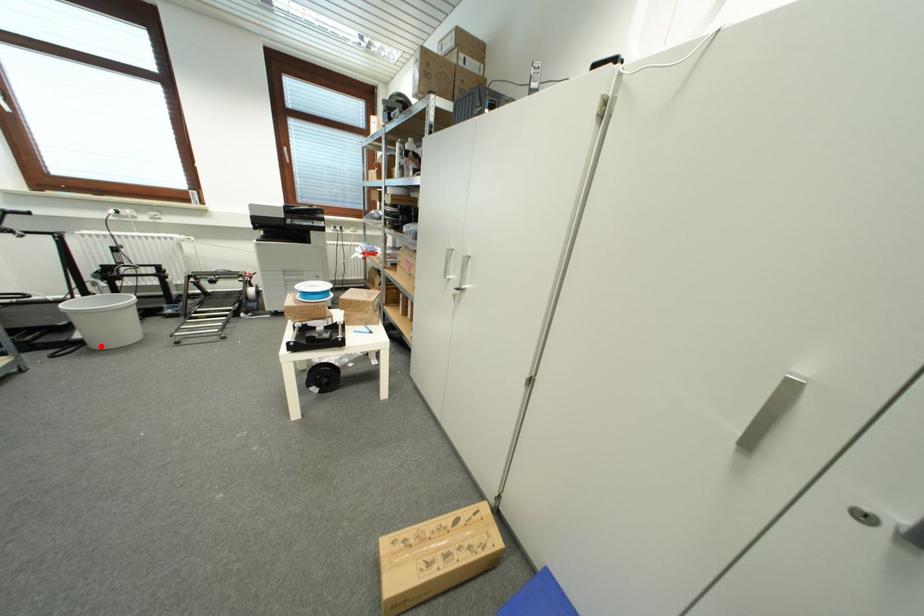
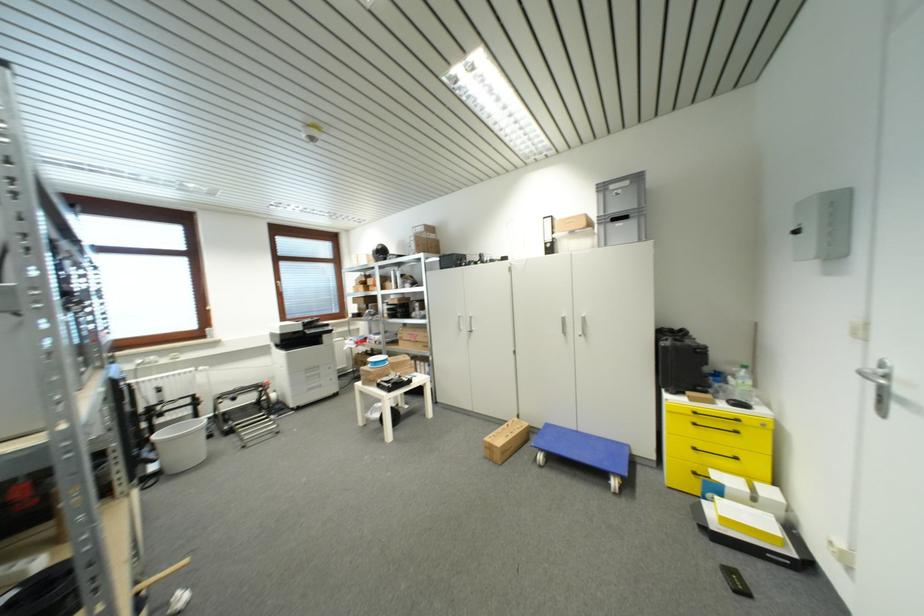
Question: I am providing you with two images of the same scene from different viewpoints. Image1 has a red point marked. In image2, the corresponding 3D location appears at what relative position? Reply with the corresponding letter.

Choices:
 (A) Closer
 (B) Farther

Answer: (B)